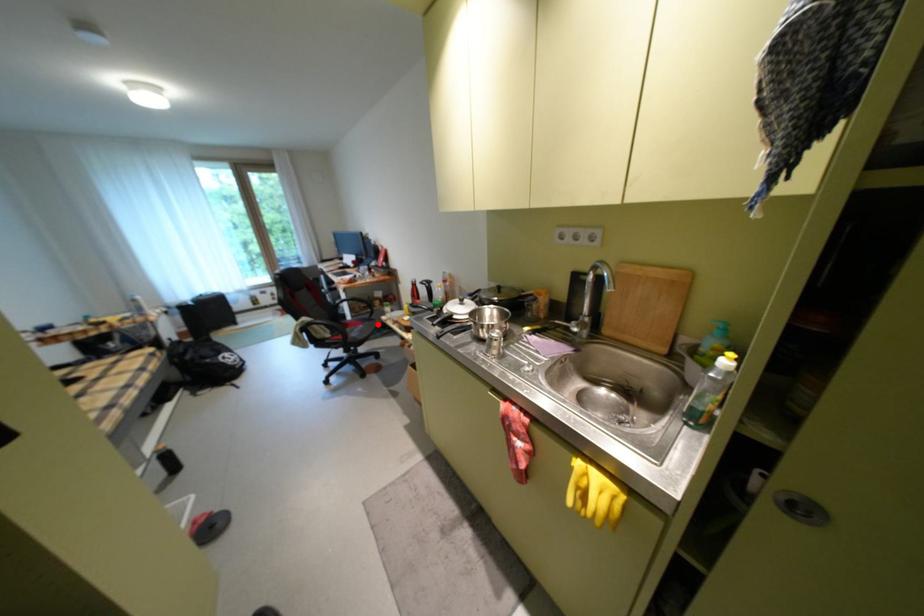
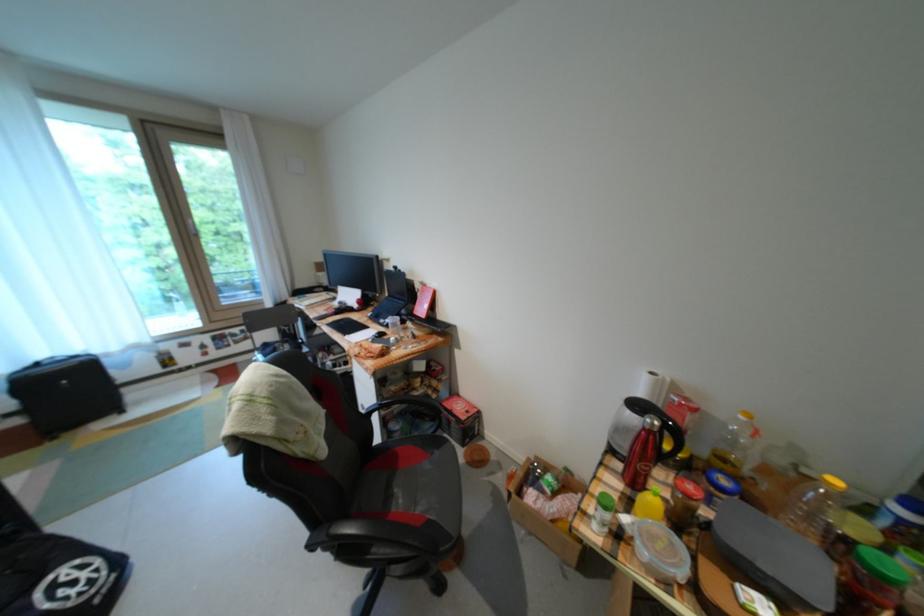
In the second image, find the point that corresponds to the highlighted location in the first image.

(446, 455)